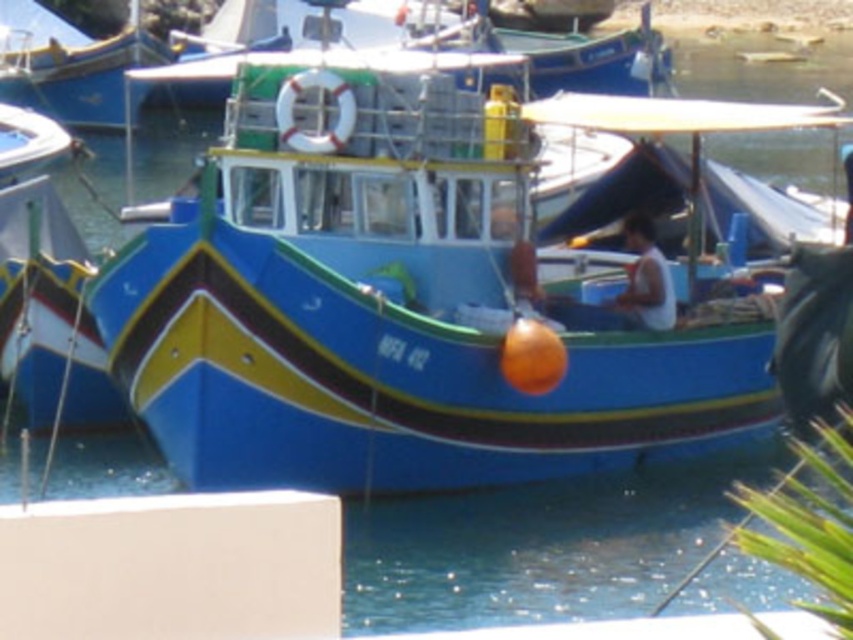
You are a photographer trying to capture both the blue glossy boat at center and the blue glossy boat at upper left in a single shot. Based on their positions, which boat should you focus on first to ensure both are in frame?

The blue glossy boat at center is located below the blue glossy boat at upper left, so you should focus on the blue glossy boat at upper left first to ensure both are in frame.

You are standing on the dock and looking at the fishing boat. There are two points marked on the boat. Which point is closer to you, point (630,109) or point (636,262)?

Point (630,109) is closer to you because it is further to the viewer than point (636,262).

What are the coordinates of the blue glossy boat at center?

The blue glossy boat at center is located at point (387,307).